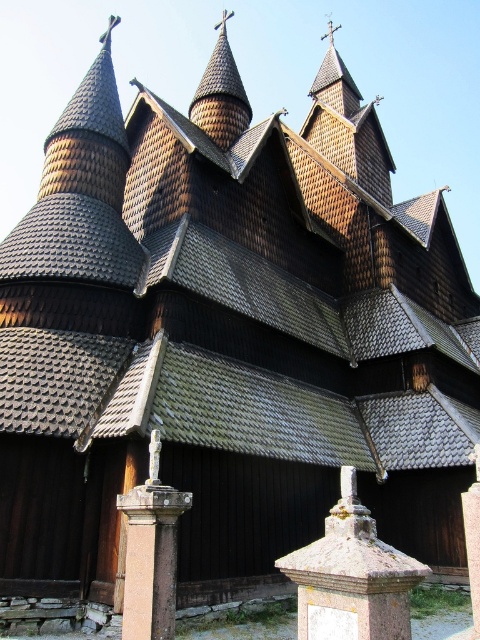
Does point (153, 576) lie in front of point (225, 44)?

Yes, point (153, 576) is closer to viewer.

Which is more to the right, pink stone pillar at lower center or dark brown wood spire at upper center?

Positioned to the right is pink stone pillar at lower center.

Does point (163, 598) lie in front of point (224, 125)?

Yes, it is in front of point (224, 125).

I want to click on pink stone pillar at lower center, so click(151, 557).

Can you confirm if dark brown wood spire at upper center is taller than smooth stone pillar at center?

Yes.

At what (x,y) coordinates should I click in order to perform the action: click on dark brown wood spire at upper center. Please return your answer as a coordinate pair (x, y). The width and height of the screenshot is (480, 640). Looking at the image, I should click on (220, 93).

Between pink stone pillar at lower center and smooth stone pillar at center, which one has less height?

pink stone pillar at lower center is shorter.

Between pink stone pillar at lower center and smooth stone pillar at center, which one appears on the right side from the viewer's perspective?

smooth stone pillar at center

Where is `pink stone pillar at lower center`? The width and height of the screenshot is (480, 640). pink stone pillar at lower center is located at coordinates (151, 557).